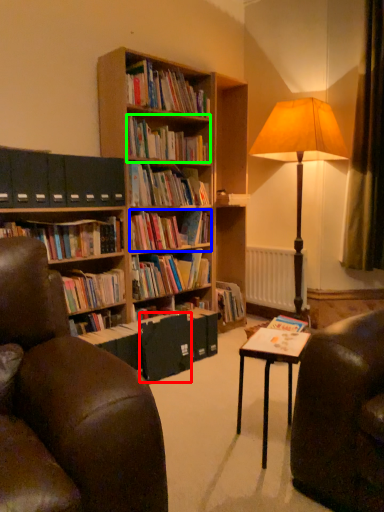
Question: Considering the real-world distances, which object is farthest from paperback book (highlighted by a red box)? book (highlighted by a blue box) or book (highlighted by a green box)?

Choices:
 (A) book
 (B) book

Answer: (B)